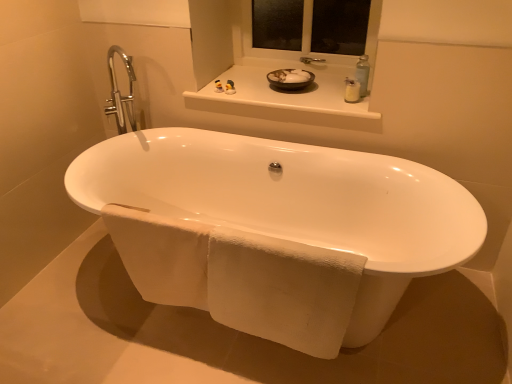
Question: From the image's perspective, is white plastic soap dispenser at upper right, the first toiletry when ordered from right to left, on matte rubber duck at upper center, acting as the second toiletry starting from the right?

Choices:
 (A) yes
 (B) no

Answer: (B)

Question: Can matte rubber duck at upper center, which appears as the 1th toiletry when viewed from the left, be found inside white plastic soap dispenser at upper right, the first toiletry when ordered from right to left?

Choices:
 (A) yes
 (B) no

Answer: (B)

Question: Would you say white plastic soap dispenser at upper right, marked as the second toiletry in a left-to-right arrangement, is a long distance from matte rubber duck at upper center, which appears as the 1th toiletry when viewed from the left?

Choices:
 (A) no
 (B) yes

Answer: (A)

Question: From a real-world perspective, is white plastic soap dispenser at upper right, marked as the second toiletry in a left-to-right arrangement, under matte rubber duck at upper center, acting as the first toiletry starting from the back?

Choices:
 (A) no
 (B) yes

Answer: (A)

Question: Are white plastic soap dispenser at upper right, marked as the second toiletry in a left-to-right arrangement, and matte rubber duck at upper center, acting as the second toiletry starting from the right, making contact?

Choices:
 (A) no
 (B) yes

Answer: (A)

Question: Is white plastic soap dispenser at upper right, arranged as the first toiletry when viewed from the front, turned away from matte rubber duck at upper center, which appears as the 1th toiletry when viewed from the left?

Choices:
 (A) no
 (B) yes

Answer: (A)

Question: Is matte rubber duck at upper center, acting as the first toiletry starting from the back, taller than white plastic window frame at upper center?

Choices:
 (A) yes
 (B) no

Answer: (B)

Question: Can you confirm if matte rubber duck at upper center, which appears as the 1th toiletry when viewed from the left, is shorter than white plastic window frame at upper center?

Choices:
 (A) yes
 (B) no

Answer: (A)

Question: Is matte rubber duck at upper center, acting as the first toiletry starting from the back, positioned before white plastic window frame at upper center?

Choices:
 (A) yes
 (B) no

Answer: (B)

Question: Is matte rubber duck at upper center, acting as the second toiletry starting from the right, aimed at white plastic window frame at upper center?

Choices:
 (A) no
 (B) yes

Answer: (A)

Question: Is matte rubber duck at upper center, acting as the second toiletry starting from the right, positioned behind white plastic window frame at upper center?

Choices:
 (A) no
 (B) yes

Answer: (B)

Question: Is matte rubber duck at upper center, which is counted as the second toiletry, starting from the front, facing away from white plastic window frame at upper center?

Choices:
 (A) yes
 (B) no

Answer: (A)

Question: Does white glossy bowl at upper center have a larger size compared to white textured towel at lower center?

Choices:
 (A) yes
 (B) no

Answer: (B)